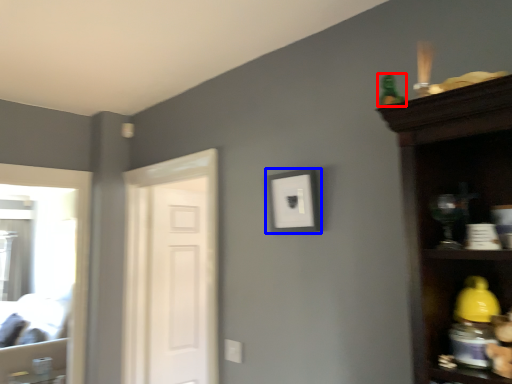
Question: Which of the following is the farthest to the observer, toy (highlighted by a red box) or picture frame (highlighted by a blue box)?

Choices:
 (A) toy
 (B) picture frame

Answer: (B)